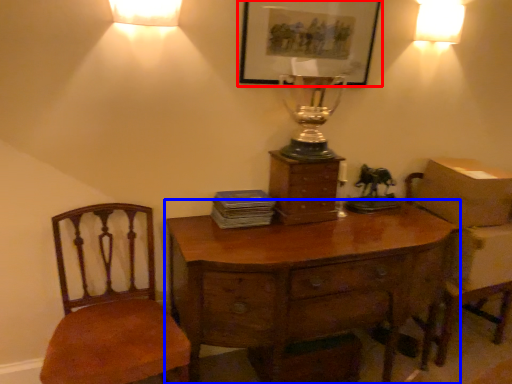
Question: Which object is closer to the camera taking this photo, picture frame (highlighted by a red box) or desk (highlighted by a blue box)?

Choices:
 (A) picture frame
 (B) desk

Answer: (B)